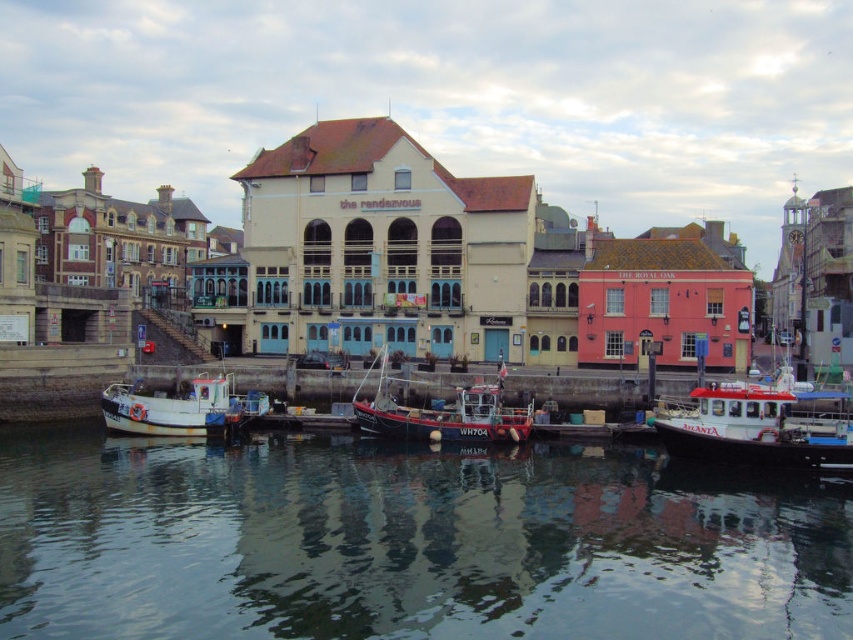
You are a tourist standing on the dock and want to take a photo of both the white plastic boat at right and the wooden fishing boat at center. Which boat should you move towards to capture both in your frame?

You should move towards the wooden fishing boat at center because the white plastic boat at right is located to the right of the wooden fishing boat at center, so positioning yourself near the wooden fishing boat at center will allow you to include both boats in your photo.

You are a tour guide leading a group around the harbor. You need to inform your group about the distance between the white plastic boat at right and the wooden fishing boat at center. What do you tell them?

The white plastic boat at right and the wooden fishing boat at center are 17.05 meters apart from each other.

You are a photographer trying to capture both the white wooden boat at center and the wooden fishing boat at center in a single shot. Which boat should you position closer to the left side of your camera frame to ensure both are visible?

You should position the white wooden boat at center closer to the left side of your camera frame because it is already on the left side of the wooden fishing boat at center.